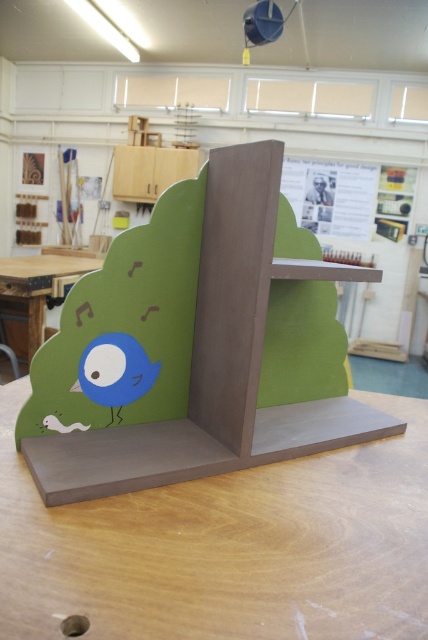
Measure the distance from matte brown table at center to matte wood table at lower left.

The distance of matte brown table at center from matte wood table at lower left is 2.71 meters.

Does point (383, 524) come farther from viewer compared to point (55, 262)?

No, (383, 524) is closer to viewer.

Identify the location of matte brown table at center. The width and height of the screenshot is (428, 640). (228, 547).

Who is higher up, matte brown table at center or matte blue bird at lower left?

matte blue bird at lower left

Is matte brown table at center wider than matte blue bird at lower left?

Indeed, matte brown table at center has a greater width compared to matte blue bird at lower left.

Who is more forward, (279, 515) or (97, 352)?

Positioned in front is point (279, 515).

At what (x,y) coordinates should I click in order to perform the action: click on matte brown table at center. Please return your answer as a coordinate pair (x, y). Image resolution: width=428 pixels, height=640 pixels. Looking at the image, I should click on (228, 547).

Who is higher up, matte blue bird at lower left or matte wood table at lower left?

Positioned higher is matte wood table at lower left.

Locate an element on the screen. This screenshot has height=640, width=428. matte blue bird at lower left is located at coordinates (115, 371).